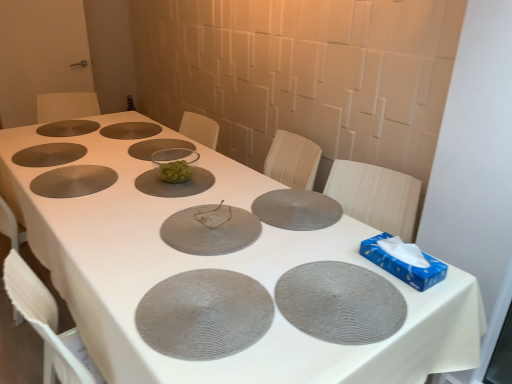
The height and width of the screenshot is (384, 512). I want to click on vacant space in front of matte gray plate at upper left, positioned as the fourth glass plate in back-to-front order, so 41,170.